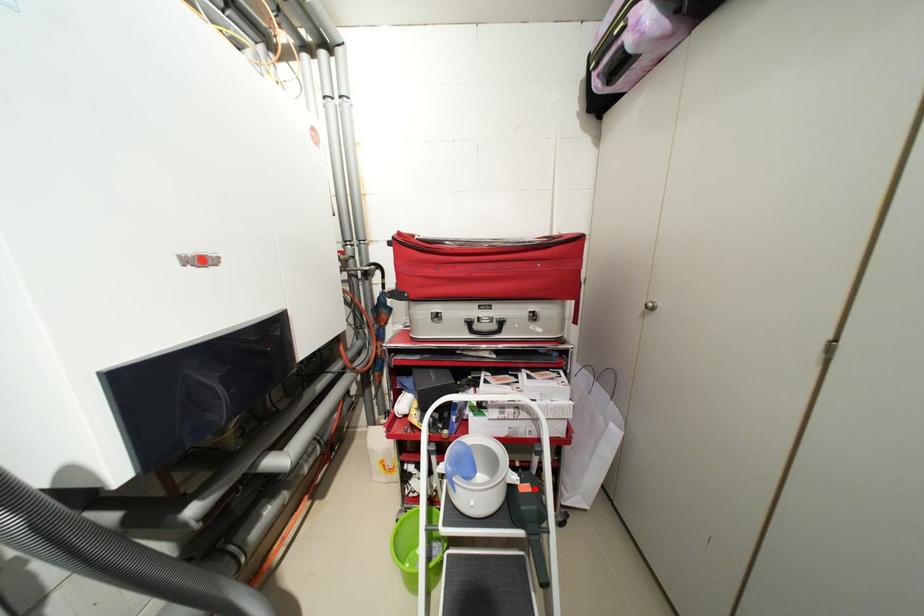
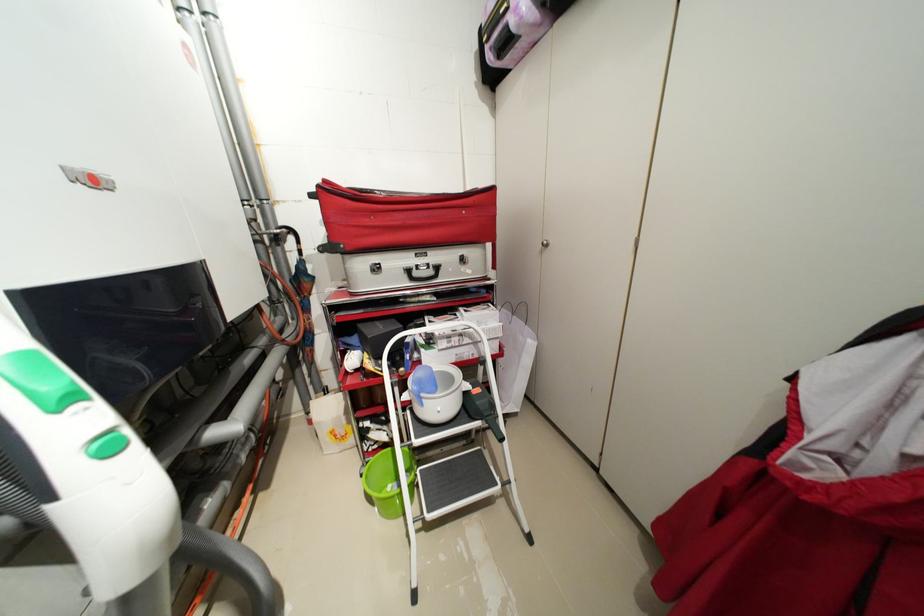
Question: I am providing you with two images of the same scene from different viewpoints. Given a red point in image1, look at the same physical point in image2. Is it:

Choices:
 (A) Closer to the viewpoint
 (B) Farther from the viewpoint

Answer: (B)